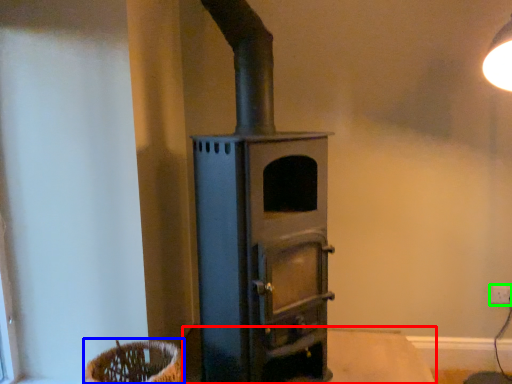
Question: Considering the real-world distances, which object is closest to table (highlighted by a red box)? basket (highlighted by a blue box) or electric outlet (highlighted by a green box).

Choices:
 (A) basket
 (B) electric outlet

Answer: (B)